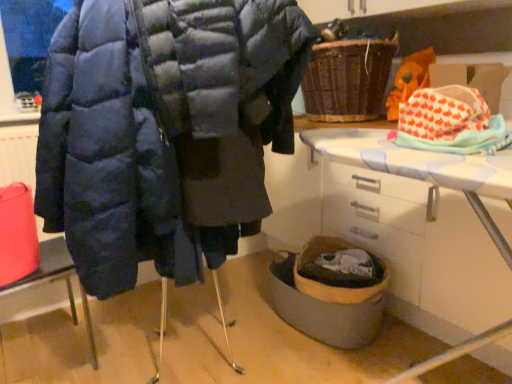
The image size is (512, 384). What are the coordinates of `white cotton fabric at upper right` in the screenshot? It's located at (450, 122).

Image resolution: width=512 pixels, height=384 pixels. I want to click on matte blue puffer jacket at center, so click(x=164, y=131).

The height and width of the screenshot is (384, 512). What do you see at coordinates (347, 79) in the screenshot? I see `woven brown basket at upper center` at bounding box center [347, 79].

The height and width of the screenshot is (384, 512). In order to click on white cotton fabric at upper right in this screenshot , I will do pos(450,122).

Is woven brown basket at upper center at the back of matte blue puffer jacket at center?

No, matte blue puffer jacket at center is not facing away from woven brown basket at upper center.

Measure the distance between matte blue puffer jacket at center and woven brown basket at upper center.

matte blue puffer jacket at center is 31.42 inches away from woven brown basket at upper center.

Considering the sizes of matte blue puffer jacket at center and woven brown basket at upper center in the image, is matte blue puffer jacket at center bigger or smaller than woven brown basket at upper center?

matte blue puffer jacket at center is bigger than woven brown basket at upper center.

Is point (269, 130) in front of point (336, 106)?

Yes, it is.

How different are the orientations of woven brown basket at upper center and matte black coat at left in degrees?

They differ by 94.6 degrees in their facing directions.

Is woven brown basket at upper center looking in the opposite direction of matte black coat at left?

woven brown basket at upper center does not have its back to matte black coat at left.

From the image's perspective, does woven brown basket at upper center appear higher than matte black coat at left?

Yes, from the image's perspective, woven brown basket at upper center is over matte black coat at left.

Considering the points (326, 77) and (76, 319), which point is in front, point (326, 77) or point (76, 319)?

Point (326, 77)

Is wooden woven basket at lower center in front of or behind woven brown basket at upper center in the image?

wooden woven basket at lower center is in front of woven brown basket at upper center.

Between point (313, 326) and point (310, 72), which one is positioned behind?

The point (310, 72) is farther.

Looking at their sizes, would you say wooden woven basket at lower center is wider or thinner than woven brown basket at upper center?

Clearly, wooden woven basket at lower center has less width compared to woven brown basket at upper center.

Is woven brown basket at upper center a part of wooden woven basket at lower center?

No, wooden woven basket at lower center does not contain woven brown basket at upper center.

Based on the photo, is the surface of white plastic table at lower right in direct contact with matte black coat at left?

There is a gap between white plastic table at lower right and matte black coat at left.

You are a GUI agent. You are given a task and a screenshot of the screen. Output one action in this format:
    pyautogui.click(x=<x>, y=<y>)
    Task: Click on the table that appears on the right of matte black coat at left
    
    Given the screenshot: What is the action you would take?
    pyautogui.click(x=415, y=240)

Is matte black coat at left at the back of white plastic table at lower right?

No, white plastic table at lower right is not facing away from matte black coat at left.

From a real-world perspective, which object rests below the other?

matte black coat at left is physically lower.

Is matte black coat at left a part of matte blue puffer jacket at center?

No.

Is matte blue puffer jacket at center to the left or to the right of matte black coat at left in the image?

From the image, it's evident that matte blue puffer jacket at center is to the right of matte black coat at left.

Is matte blue puffer jacket at center in front of or behind matte black coat at left in the image?

matte blue puffer jacket at center is in front of matte black coat at left.

Is matte blue puffer jacket at center aimed at matte black coat at left?

No, matte blue puffer jacket at center is not oriented towards matte black coat at left.

Is point (380, 105) positioned before point (479, 314)?

No, (380, 105) is behind (479, 314).

Does woven brown basket at upper center have a greater width compared to white plastic table at lower right?

No.

Which object is positioned more to the left, woven brown basket at upper center or white plastic table at lower right?

woven brown basket at upper center is more to the left.

From the image's perspective, which is below, woven brown basket at upper center or white plastic table at lower right?

white plastic table at lower right appears lower in the image.

Is there a large distance between matte blue puffer jacket at center and white cotton fabric at upper right?

Actually, matte blue puffer jacket at center and white cotton fabric at upper right are a little close together.

Is matte blue puffer jacket at center bigger than white cotton fabric at upper right?

Yes, matte blue puffer jacket at center is bigger than white cotton fabric at upper right.

Is the position of matte blue puffer jacket at center less distant than that of white cotton fabric at upper right?

Yes, it is.

Looking at their sizes, would you say matte blue puffer jacket at center is wider or thinner than white cotton fabric at upper right?

In the image, matte blue puffer jacket at center appears to be wider than white cotton fabric at upper right.

The height and width of the screenshot is (384, 512). Find the location of `jacket that appears on the left of woven brown basket at upper center`. jacket that appears on the left of woven brown basket at upper center is located at coordinates (164, 131).

Locate an element on the screen. The image size is (512, 384). basket behind the matte black coat at left is located at coordinates (347, 79).

Based on their spatial positions, is woven brown basket at upper center or white plastic table at lower right further from wooden woven basket at lower center?

Among the two, woven brown basket at upper center is located further to wooden woven basket at lower center.

From the image, which object appears to be farther from matte blue puffer jacket at center, white cotton fabric at upper right or matte black coat at left?

Among the two, matte black coat at left is located further to matte blue puffer jacket at center.

Considering their positions, is white cotton fabric at upper right positioned closer to matte blue puffer jacket at center than white plastic table at lower right?

white cotton fabric at upper right is positioned closer to the anchor matte blue puffer jacket at center.

Which object lies nearer to the anchor point woven brown basket at upper center, matte blue puffer jacket at center or white cotton fabric at upper right?

matte blue puffer jacket at center is positioned closer to the anchor woven brown basket at upper center.

Which object lies further to the anchor point white cotton fabric at upper right, matte black coat at left or white plastic table at lower right?

The object further to white cotton fabric at upper right is matte black coat at left.

Considering their positions, is white plastic table at lower right positioned closer to wooden woven basket at lower center than woven brown basket at upper center?

The object closer to wooden woven basket at lower center is white plastic table at lower right.

When comparing their distances from matte black coat at left, does matte blue puffer jacket at center or woven brown basket at upper center seem further?

woven brown basket at upper center is further to matte black coat at left.

Which object lies further to the anchor point matte blue puffer jacket at center, woven brown basket at upper center or wooden woven basket at lower center?

The object further to matte blue puffer jacket at center is woven brown basket at upper center.

Identify the location of table between white cotton fabric at upper right and wooden woven basket at lower center vertically. (415, 240).

Image resolution: width=512 pixels, height=384 pixels. Find the location of `basket container between matte black coat at left and white cotton fabric at upper right in the horizontal direction`. basket container between matte black coat at left and white cotton fabric at upper right in the horizontal direction is located at coordinates (327, 299).

Identify the location of table between woven brown basket at upper center and wooden woven basket at lower center from top to bottom. The width and height of the screenshot is (512, 384). (415, 240).

Identify the location of material between woven brown basket at upper center and wooden woven basket at lower center from top to bottom. This screenshot has width=512, height=384. (450, 122).